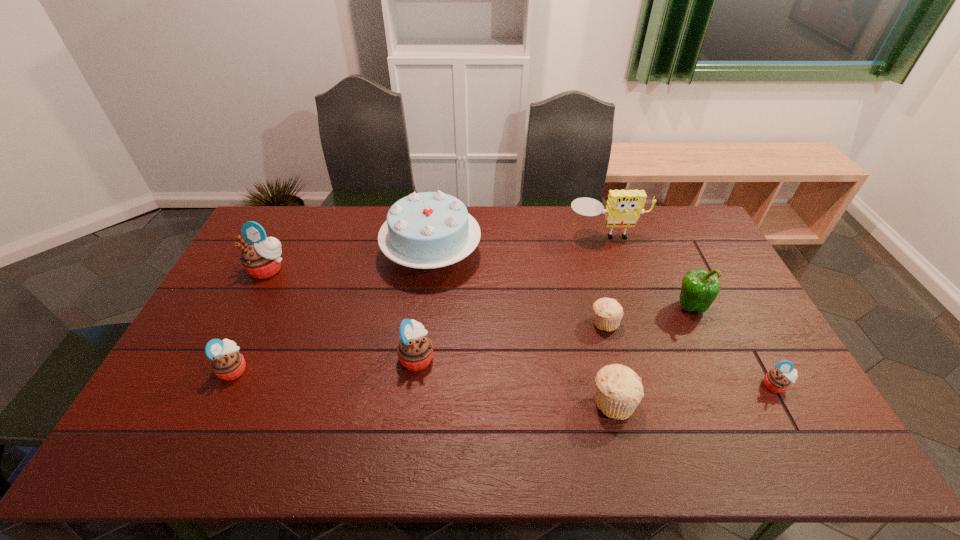
Identify the location of the smallest pink muffin. pyautogui.click(x=778, y=380).

I want to click on the farther beige muffin, so click(x=608, y=312).

Find the location of `the smaller beige muffin`. the smaller beige muffin is located at coordinates (608, 312).

Where is `vacant space located on the right of the blue birthday cake`? The image size is (960, 540). vacant space located on the right of the blue birthday cake is located at coordinates (549, 254).

The width and height of the screenshot is (960, 540). What are the coordinates of `vacant region located 0.220m on the front-facing side of the sponge` in the screenshot? It's located at (623, 289).

Where is `free region located on the front-facing side of the farthest pink muffin`? The height and width of the screenshot is (540, 960). free region located on the front-facing side of the farthest pink muffin is located at coordinates (216, 372).

I want to click on free spot located 0.390m on the left of the green bell pepper, so click(x=547, y=306).

The image size is (960, 540). What are the coordinates of `free space located on the front-facing side of the second biggest pink muffin` in the screenshot? It's located at (499, 357).

Locate an element on the screen. This screenshot has height=540, width=960. vacant region located on the front-facing side of the second smallest pink muffin is located at coordinates (336, 369).

Locate an element on the screen. The image size is (960, 540). vacant space situated 0.350m on the left of the bigger beige muffin is located at coordinates (453, 402).